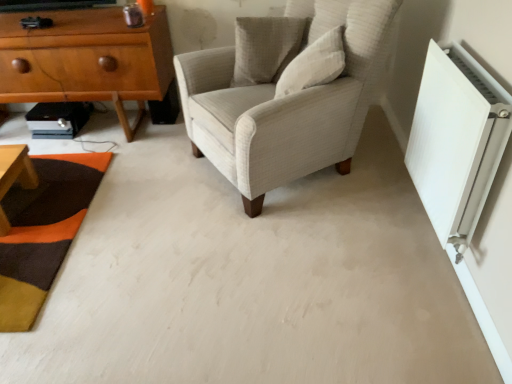
This screenshot has height=384, width=512. Find the location of `vacant space situated on the left part of light beige fabric armchair at center`. vacant space situated on the left part of light beige fabric armchair at center is located at coordinates (147, 190).